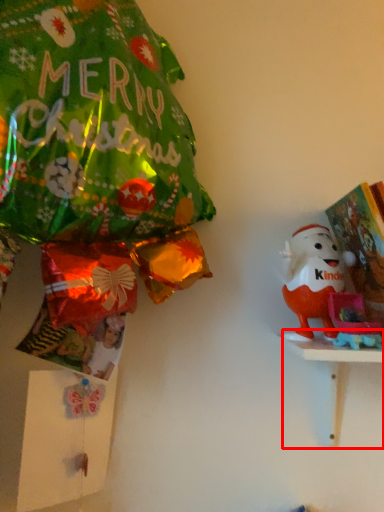
Question: From the image's perspective, what is the correct spatial relationship of table (annotated by the red box) in relation to toy?

Choices:
 (A) below
 (B) above

Answer: (A)